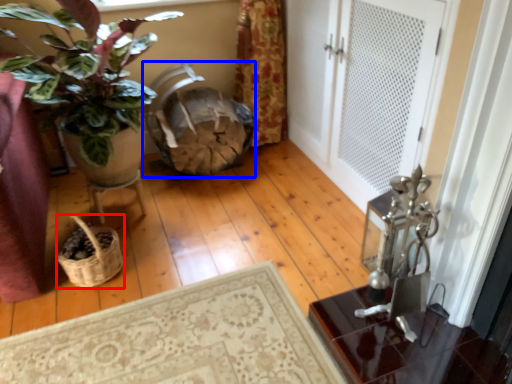
Question: Among these objects, which one is nearest to the camera, basket (highlighted by a red box) or rocking chair (highlighted by a blue box)?

Choices:
 (A) basket
 (B) rocking chair

Answer: (A)